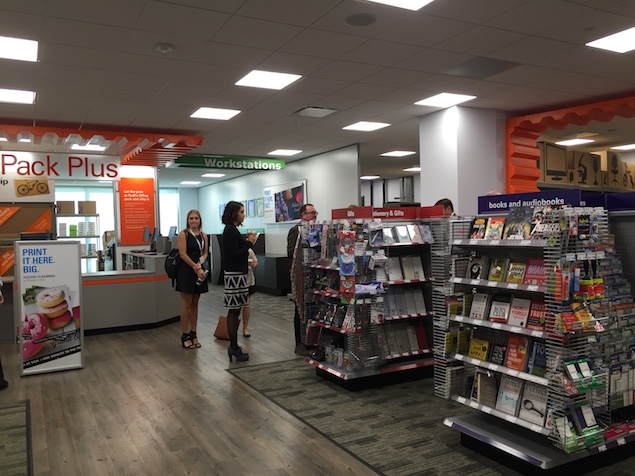
I want to click on ceiling tile, so click(x=385, y=82).